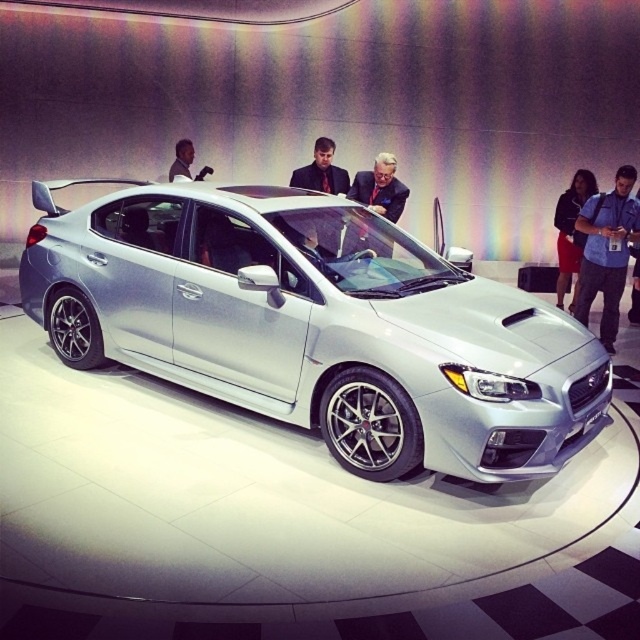
Which is more to the right, dark suit at center or dark skin smooth face at upper center?

Answer: From the viewer's perspective, dark suit at center appears more on the right side.

Can you confirm if dark suit at center is taller than dark skin smooth face at upper center?

Yes, dark suit at center is taller than dark skin smooth face at upper center.

Is point (378, 202) positioned before point (170, 179)?

Yes, it is in front of point (170, 179).

Where is `dark suit at center`? This screenshot has height=640, width=640. dark suit at center is located at coordinates (380, 188).

Is dark suit at center to the right of red skirt at lower right from the viewer's perspective?

Incorrect, dark suit at center is not on the right side of red skirt at lower right.

Is dark suit at center taller than red skirt at lower right?

Incorrect, dark suit at center's height is not larger of red skirt at lower right's.

Identify the location of dark suit at center. (380, 188).

Is point (317, 179) behind point (186, 163)?

No, it is in front of (186, 163).

Is dark brown suit at center below dark skin smooth face at upper center?

Yes.

Is point (310, 173) in front of point (186, 148)?

Yes, it is in front of point (186, 148).

Where is `dark brown suit at center`? This screenshot has height=640, width=640. dark brown suit at center is located at coordinates (321, 170).